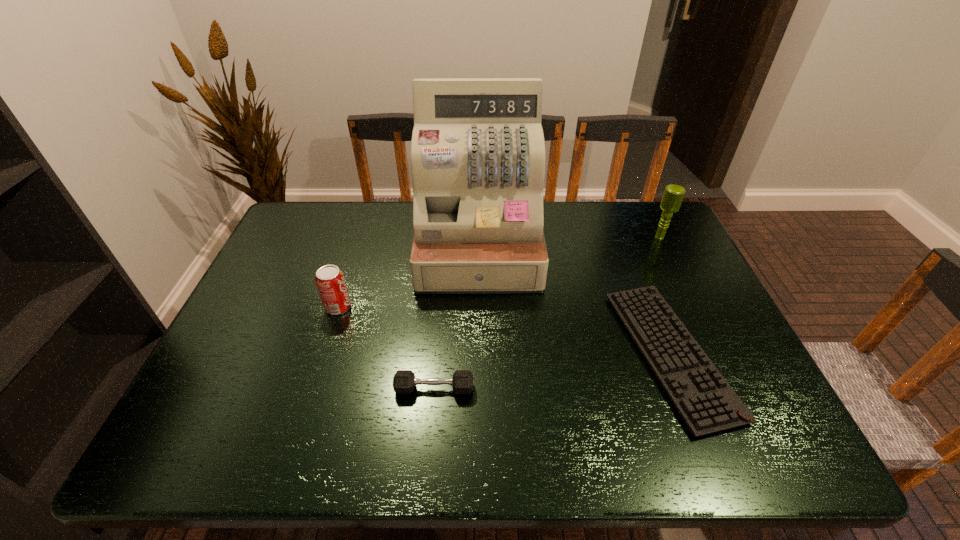
Select which object appears as the fourth closest to the tallest object. Please provide its 2D coordinates. Your answer should be formatted as a tuple, i.e. [(x, y)], where the tuple contains the x and y coordinates of a point satisfying the conditions above.

[(673, 195)]

Identify the location of object that is the third nearest to the microphone. The width and height of the screenshot is (960, 540). (404, 381).

What are the coordinates of `vacant space that satisfies the following two spatial constraints: 1. on the operating side of the computer keyboard; 2. on the right side of the tallest object` in the screenshot? It's located at (478, 354).

Identify the location of vacant space that satisfies the following two spatial constraints: 1. on the operating side of the computer keyboard; 2. on the left side of the cash register. The height and width of the screenshot is (540, 960). (478, 354).

You are a GUI agent. You are given a task and a screenshot of the screen. Output one action in this format:
    pyautogui.click(x=<x>, y=<y>)
    Task: Click on the vacant position in the image that satisfies the following two spatial constraints: 1. on the operating side of the cash register; 2. on the left side of the computer keyboard
    The image size is (960, 540).
    Given the screenshot: What is the action you would take?
    pyautogui.click(x=478, y=354)

In order to click on vacant space that satisfies the following two spatial constraints: 1. on the operating side of the cash register; 2. on the right side of the computer keyboard in this screenshot , I will do `click(478, 354)`.